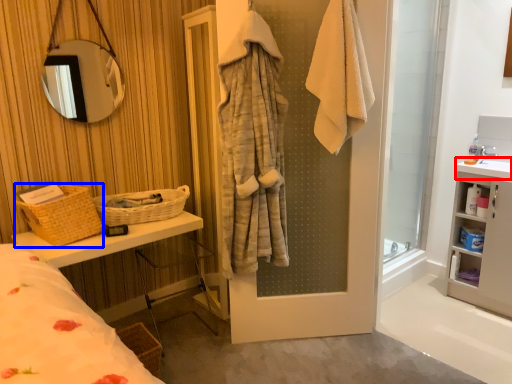
Question: Which object is closer to the camera taking this photo, counter top (highlighted by a red box) or basket (highlighted by a blue box)?

Choices:
 (A) counter top
 (B) basket

Answer: (B)